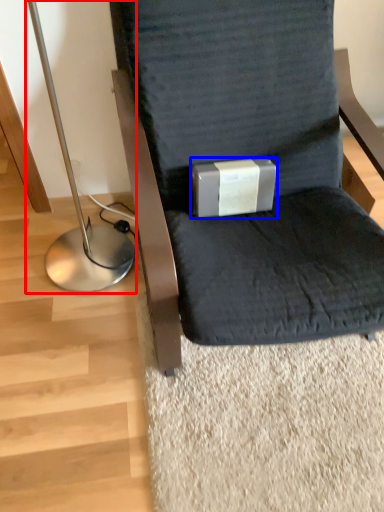
Question: Which object is closer to the camera taking this photo, bedside lamp (highlighted by a red box) or box (highlighted by a blue box)?

Choices:
 (A) bedside lamp
 (B) box

Answer: (A)